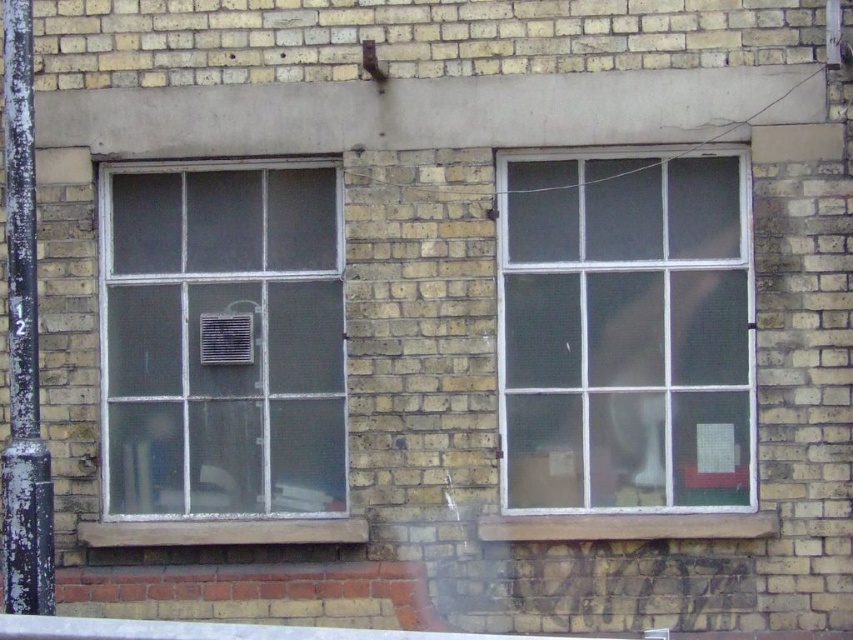
Question: Which of the following is the closest to the observer?

Choices:
 (A) clear glass window at left
 (B) clear glass window at right

Answer: (B)

Question: Is clear glass window at right positioned behind clear glass window at left?

Choices:
 (A) no
 (B) yes

Answer: (A)

Question: Is clear glass window at right thinner than clear glass window at left?

Choices:
 (A) no
 (B) yes

Answer: (A)

Question: Which object is closer to the camera taking this photo?

Choices:
 (A) clear glass window at right
 (B) clear glass window at left

Answer: (A)

Question: Which point appears farthest from the camera in this image?

Choices:
 (A) (320, 305)
 (B) (612, 490)

Answer: (A)

Question: Is clear glass window at right above clear glass window at left?

Choices:
 (A) yes
 (B) no

Answer: (A)